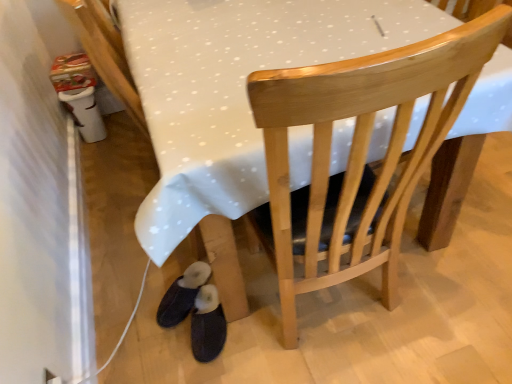
Question: Can you confirm if wooden chair at center is smaller than black suede slippers at lower left, positioned as the first footwear in left-to-right order?

Choices:
 (A) no
 (B) yes

Answer: (A)

Question: From a real-world perspective, does wooden chair at center stand above black suede slippers at lower left, positioned as the first footwear in left-to-right order?

Choices:
 (A) yes
 (B) no

Answer: (A)

Question: Is the depth of wooden chair at center greater than that of black suede slippers at lower left, positioned as the first footwear in left-to-right order?

Choices:
 (A) no
 (B) yes

Answer: (A)

Question: From the image's perspective, does wooden chair at center appear higher than black suede slippers at lower left, which appears as the 2th footwear when viewed from the right?

Choices:
 (A) yes
 (B) no

Answer: (A)

Question: Considering the relative sizes of wooden chair at center and black suede slippers at lower left, which appears as the 2th footwear when viewed from the right, in the image provided, is wooden chair at center taller than black suede slippers at lower left, which appears as the 2th footwear when viewed from the right,?

Choices:
 (A) no
 (B) yes

Answer: (B)

Question: From the image's perspective, is wooden chair at center located above or below dark blue fabric slippers at lower left, marked as the 2th footwear in a left-to-right arrangement?

Choices:
 (A) above
 (B) below

Answer: (A)

Question: Would you say wooden chair at center is to the left or to the right of dark blue fabric slippers at lower left, marked as the 2th footwear in a left-to-right arrangement, in the picture?

Choices:
 (A) right
 (B) left

Answer: (A)

Question: Relative to dark blue fabric slippers at lower left, marked as the 1th footwear in a right-to-left arrangement, is wooden chair at center in front or behind?

Choices:
 (A) front
 (B) behind

Answer: (A)

Question: From a real-world perspective, is wooden chair at center above or below dark blue fabric slippers at lower left, marked as the 1th footwear in a right-to-left arrangement?

Choices:
 (A) above
 (B) below

Answer: (A)

Question: Considering their positions, is dark blue fabric slippers at lower left, marked as the 1th footwear in a right-to-left arrangement, located in front of or behind wooden chair at center?

Choices:
 (A) front
 (B) behind

Answer: (B)

Question: Is dark blue fabric slippers at lower left, marked as the 1th footwear in a right-to-left arrangement, inside or outside of wooden chair at center?

Choices:
 (A) outside
 (B) inside

Answer: (A)

Question: Considering the positions of dark blue fabric slippers at lower left, marked as the 2th footwear in a left-to-right arrangement, and wooden chair at center in the image, is dark blue fabric slippers at lower left, marked as the 2th footwear in a left-to-right arrangement, bigger or smaller than wooden chair at center?

Choices:
 (A) small
 (B) big

Answer: (A)

Question: From a real-world perspective, is dark blue fabric slippers at lower left, marked as the 1th footwear in a right-to-left arrangement, above or below wooden chair at center?

Choices:
 (A) below
 (B) above

Answer: (A)

Question: From a real-world perspective, is dark blue fabric slippers at lower left, marked as the 2th footwear in a left-to-right arrangement, physically located above or below black suede slippers at lower left, positioned as the first footwear in left-to-right order?

Choices:
 (A) above
 (B) below

Answer: (A)

Question: Is dark blue fabric slippers at lower left, marked as the 1th footwear in a right-to-left arrangement, in front of or behind black suede slippers at lower left, which appears as the 2th footwear when viewed from the right, in the image?

Choices:
 (A) front
 (B) behind

Answer: (A)